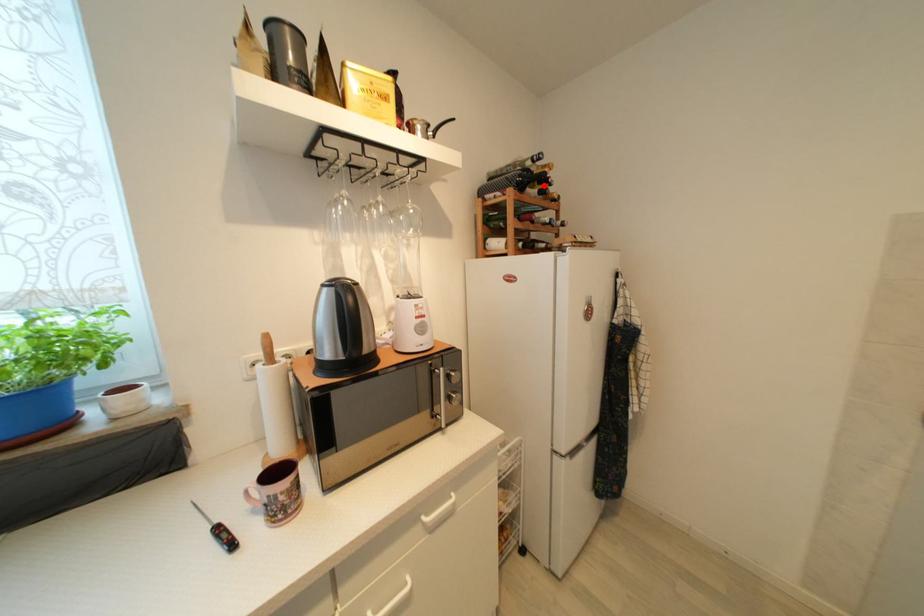
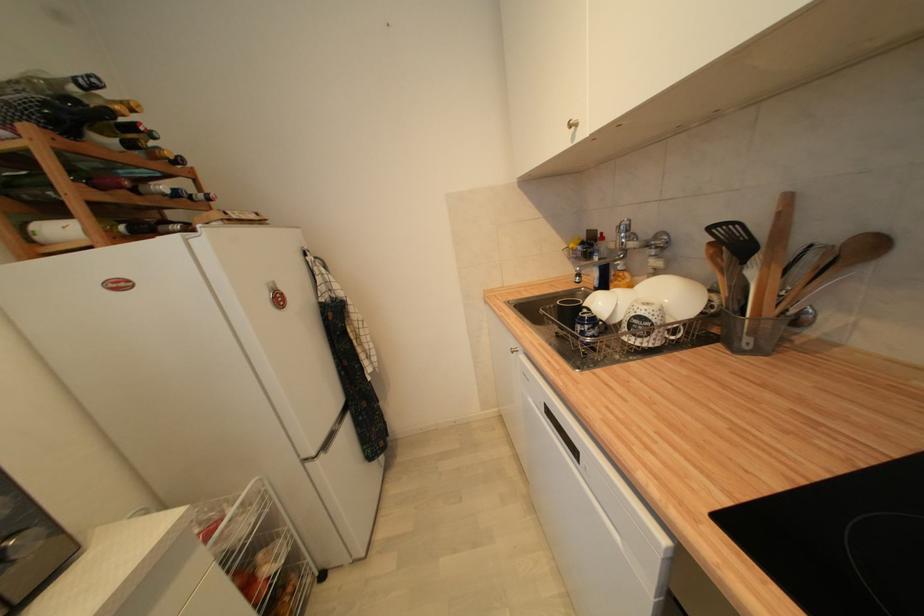
Locate, in the second image, the point that corresponds to the highlighted location in the first image.

(128, 132)